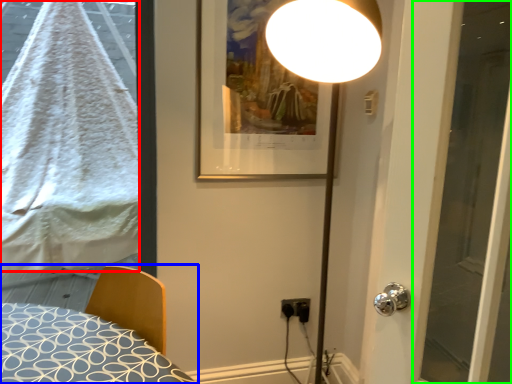
Question: Estimate the real-world distances between objects in this image. Which object is farther from blanket (highlighted by a red box), bed (highlighted by a blue box) or screen door (highlighted by a green box)?

Choices:
 (A) bed
 (B) screen door

Answer: (B)